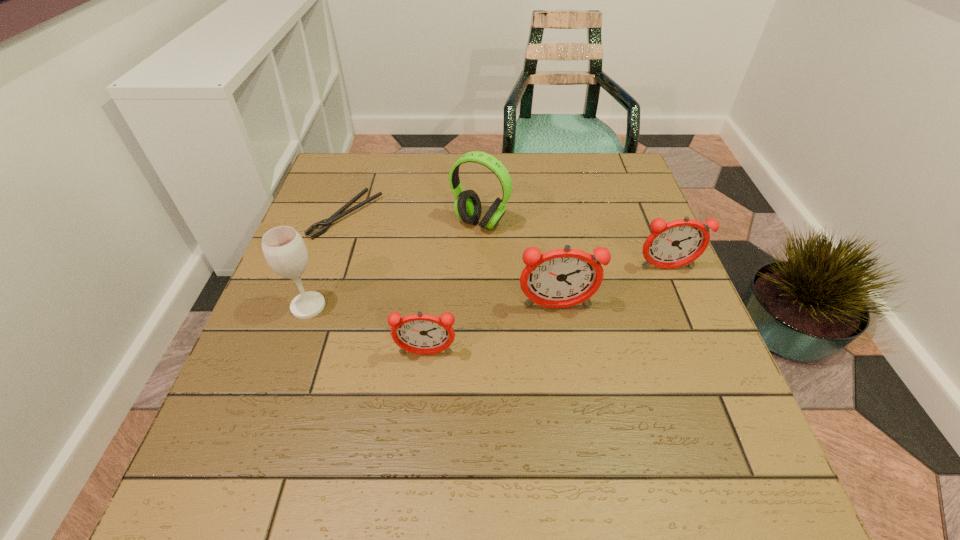
The width and height of the screenshot is (960, 540). In order to click on free space located on the front-facing side of the fifth object from left to right in this screenshot , I will do `click(573, 411)`.

Find the location of `vacant space located 0.140m on the front-facing side of the third farthest object`. vacant space located 0.140m on the front-facing side of the third farthest object is located at coordinates (688, 321).

Where is `vacant space located 0.290m on the front of the tongs`? vacant space located 0.290m on the front of the tongs is located at coordinates (306, 335).

Find the location of `vacant space located 0.160m on the right of the wineglass`. vacant space located 0.160m on the right of the wineglass is located at coordinates (x=400, y=306).

This screenshot has width=960, height=540. I want to click on vacant space located on the left of the headset, so click(x=377, y=223).

At what (x,y) coordinates should I click in order to perform the action: click on object present at the far edge. Please return your answer as a coordinate pair (x, y). Image resolution: width=960 pixels, height=540 pixels. Looking at the image, I should click on (326, 223).

Locate an element on the screen. The image size is (960, 540). tongs that is at the left edge is located at coordinates (326, 223).

The width and height of the screenshot is (960, 540). Find the location of `wineglass at the left edge`. wineglass at the left edge is located at coordinates (283, 247).

Where is `object that is at the right edge`? object that is at the right edge is located at coordinates (677, 243).

Where is `object situated at the far left corner`? This screenshot has height=540, width=960. object situated at the far left corner is located at coordinates (326, 223).